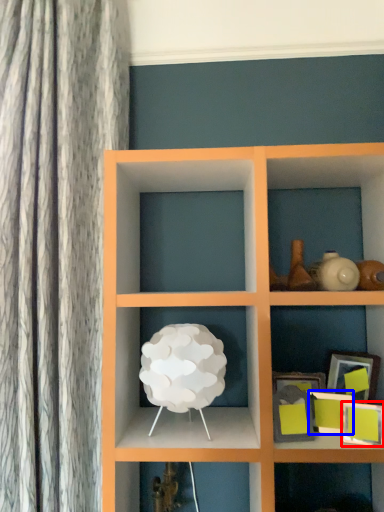
Question: Which object is closer to the camera taking this photo, picture frame (highlighted by a red box) or picture frame (highlighted by a blue box)?

Choices:
 (A) picture frame
 (B) picture frame

Answer: (A)